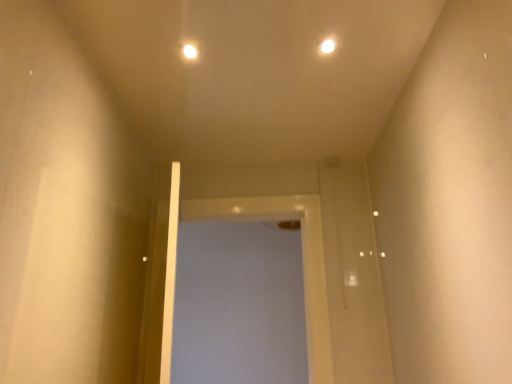
Locate an element on the screen. This screenshot has width=512, height=384. white glossy light at upper center, the first light when ordered from left to right is located at coordinates (190, 50).

The height and width of the screenshot is (384, 512). What do you see at coordinates (190, 50) in the screenshot? I see `white glossy light at upper center, the first light when ordered from left to right` at bounding box center [190, 50].

Image resolution: width=512 pixels, height=384 pixels. Describe the element at coordinates (328, 46) in the screenshot. I see `white glossy light at upper center, acting as the 1th light starting from the right` at that location.

Image resolution: width=512 pixels, height=384 pixels. I want to click on white glossy screen door at center, so click(303, 266).

Could you measure the distance between white glossy screen door at center and white glossy light at upper center, the 2th light in the left-to-right sequence?

white glossy screen door at center and white glossy light at upper center, the 2th light in the left-to-right sequence, are 4.36 feet apart.

Can you tell me how much white glossy screen door at center and white glossy light at upper center, the 2th light in the left-to-right sequence, differ in facing direction?

They differ by 0.0027 degrees in their facing directions.

Is point (315, 339) less distant than point (328, 39)?

No, (315, 339) is further to viewer.

From the picture: Can white glossy light at upper center, acting as the 1th light starting from the right, be found inside white glossy screen door at center?

Definitely not — white glossy light at upper center, acting as the 1th light starting from the right, is not inside white glossy screen door at center.

From the image's perspective, is white glossy screen door at center located above or below white glossy light at upper center, the second light positioned from the right?

Clearly, from the image's perspective, white glossy screen door at center is below white glossy light at upper center, the second light positioned from the right.

In the scene shown: Is white glossy screen door at center to the left of white glossy light at upper center, the first light when ordered from left to right, from the viewer's perspective?

No.

From a real-world perspective, is white glossy screen door at center positioned above or below white glossy light at upper center, the first light when ordered from left to right?

From a real-world perspective, white glossy screen door at center is physically below white glossy light at upper center, the first light when ordered from left to right.

Based on the photo, considering the sizes of objects white glossy screen door at center and white glossy light at upper center, the first light when ordered from left to right, in the image provided, who is smaller, white glossy screen door at center or white glossy light at upper center, the first light when ordered from left to right,?

white glossy light at upper center, the first light when ordered from left to right.

Considering the relative positions of white glossy light at upper center, the first light when ordered from left to right, and white glossy light at upper center, the 2th light in the left-to-right sequence, in the image provided, is white glossy light at upper center, the first light when ordered from left to right, in front of white glossy light at upper center, the 2th light in the left-to-right sequence,?

No, it is not.

In the scene shown: Which is closer, (184, 58) or (325, 42)?

Point (325, 42)

Can you see white glossy light at upper center, the first light when ordered from left to right, touching white glossy light at upper center, the 2th light in the left-to-right sequence?

No, white glossy light at upper center, the first light when ordered from left to right, is not making contact with white glossy light at upper center, the 2th light in the left-to-right sequence.

Considering the sizes of white glossy light at upper center, the first light when ordered from left to right, and white glossy light at upper center, the 2th light in the left-to-right sequence, in the image, is white glossy light at upper center, the first light when ordered from left to right, bigger or smaller than white glossy light at upper center, the 2th light in the left-to-right sequence,?

In the image, white glossy light at upper center, the first light when ordered from left to right, appears to be smaller than white glossy light at upper center, the 2th light in the left-to-right sequence.

Is white glossy light at upper center, acting as the 1th light starting from the right, next to white glossy light at upper center, the second light positioned from the right, and touching it?

No.

Is white glossy light at upper center, acting as the 1th light starting from the right, positioned in front of white glossy light at upper center, the first light when ordered from left to right?

That is True.

Based on their sizes in the image, would you say white glossy light at upper center, acting as the 1th light starting from the right, is bigger or smaller than white glossy light at upper center, the second light positioned from the right?

In the image, white glossy light at upper center, acting as the 1th light starting from the right, appears to be larger than white glossy light at upper center, the second light positioned from the right.

You are a GUI agent. You are given a task and a screenshot of the screen. Output one action in this format:
    pyautogui.click(x=<x>, y=<y>)
    Task: Click on the screen door behind the white glossy light at upper center, the 2th light in the left-to-right sequence
    Image resolution: width=512 pixels, height=384 pixels.
    Given the screenshot: What is the action you would take?
    pyautogui.click(x=303, y=266)

Considering the relative sizes of white glossy light at upper center, the 2th light in the left-to-right sequence, and white glossy screen door at center in the image provided, is white glossy light at upper center, the 2th light in the left-to-right sequence, bigger than white glossy screen door at center?

Actually, white glossy light at upper center, the 2th light in the left-to-right sequence, might be smaller than white glossy screen door at center.

Is white glossy light at upper center, the 2th light in the left-to-right sequence, turned away from white glossy screen door at center?

white glossy light at upper center, the 2th light in the left-to-right sequence, is not turned away from white glossy screen door at center.

Is point (325, 40) closer to viewer compared to point (308, 326)?

Yes, point (325, 40) is in front of point (308, 326).

Looking at their sizes, would you say white glossy light at upper center, the second light positioned from the right, is wider or thinner than white glossy screen door at center?

white glossy light at upper center, the second light positioned from the right, is thinner than white glossy screen door at center.

Considering the relative sizes of white glossy light at upper center, the second light positioned from the right, and white glossy screen door at center in the image provided, is white glossy light at upper center, the second light positioned from the right, smaller than white glossy screen door at center?

Yes.

How different are the orientations of white glossy light at upper center, the first light when ordered from left to right, and white glossy screen door at center in degrees?

They differ by 0.00319 degrees in their facing directions.

Is white glossy light at upper center, the first light when ordered from left to right, positioned beyond the bounds of white glossy screen door at center?

Yes, white glossy light at upper center, the first light when ordered from left to right, is outside of white glossy screen door at center.

The image size is (512, 384). Identify the location of screen door that appears below the white glossy light at upper center, the 2th light in the left-to-right sequence (from a real-world perspective). (303, 266).

Identify the location of screen door behind the white glossy light at upper center, the first light when ordered from left to right. (303, 266).

From the image, which object appears to be nearer to white glossy screen door at center, white glossy light at upper center, acting as the 1th light starting from the right, or white glossy light at upper center, the first light when ordered from left to right?

The object closer to white glossy screen door at center is white glossy light at upper center, the first light when ordered from left to right.

In the scene shown: When comparing their distances from white glossy light at upper center, acting as the 1th light starting from the right, does white glossy screen door at center or white glossy light at upper center, the first light when ordered from left to right, seem further?

white glossy screen door at center is positioned further to the anchor white glossy light at upper center, acting as the 1th light starting from the right.

Looking at this image, based on their spatial positions, is white glossy light at upper center, the first light when ordered from left to right, or white glossy light at upper center, the 2th light in the left-to-right sequence, further from white glossy screen door at center?

white glossy light at upper center, the 2th light in the left-to-right sequence, is positioned further to the anchor white glossy screen door at center.

Looking at the image, which one is located further to white glossy light at upper center, the second light positioned from the right, white glossy light at upper center, acting as the 1th light starting from the right, or white glossy screen door at center?

The object further to white glossy light at upper center, the second light positioned from the right, is white glossy screen door at center.

Based on their spatial positions, is white glossy light at upper center, the first light when ordered from left to right, or white glossy screen door at center further from white glossy light at upper center, acting as the 1th light starting from the right?

white glossy screen door at center is positioned further to the anchor white glossy light at upper center, acting as the 1th light starting from the right.

From the image, which object appears to be nearer to white glossy light at upper center, the first light when ordered from left to right, white glossy screen door at center or white glossy light at upper center, acting as the 1th light starting from the right?

The object closer to white glossy light at upper center, the first light when ordered from left to right, is white glossy light at upper center, acting as the 1th light starting from the right.

Identify the location of light between white glossy light at upper center, the 2th light in the left-to-right sequence, and white glossy screen door at center, in the vertical direction. (190, 50).